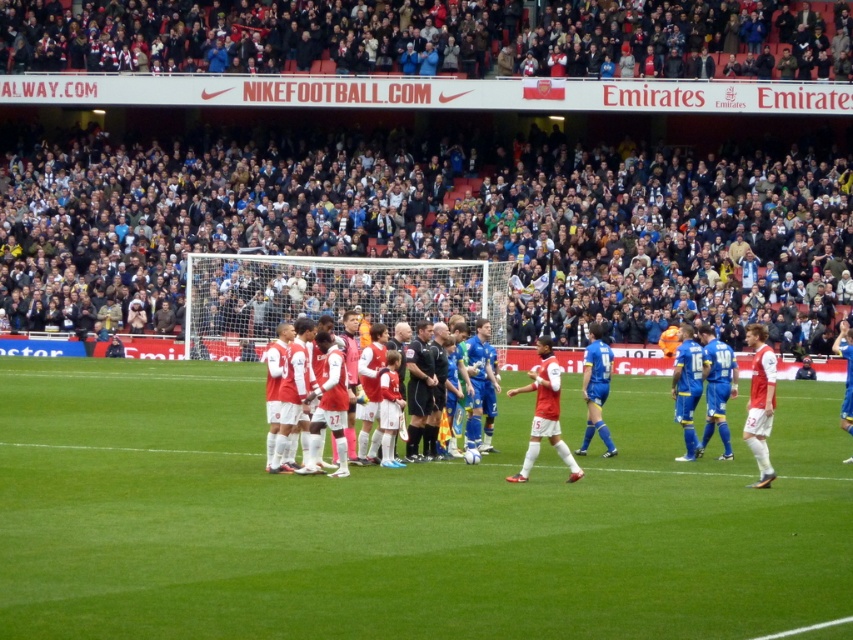
You are a drone operator tasked with capturing aerial footage of the green grass football field at center. The camera is currently positioned at point A, which is at coordinates 0.7, 0.5. To ensure the best shot, you need to adjust the camera to the exact center of the field. In which direction should you move the camera horizontally and vertically relative to the current position?

The green grass football field at center is located at coordinates (398, 520). The camera is at (426, 448). To reach the field, move the camera 0.114 units to the right and 0.032 units downward.

You are a drone operator trying to capture aerial footage of the football match. The dark gray fabric crowd at upper center is your main focus. According to the coordinates provided, where should you position the drone to ensure the crowd is centered in the frame?

The dark gray fabric crowd at upper center is located at point (425, 227), so you should position the drone at those coordinates to center the crowd in the frame.

You are a photographer at the edge of the field. You notice two groups of players in white jerseys at the center of the field. One group is labeled as white jersey soccer players at center and the other as white matte jersey at center. Based on their height, which group would appear shorter in your photo?

The white jersey soccer players at center would appear shorter in the photo since they have a lesser height compared to the white matte jersey at center.